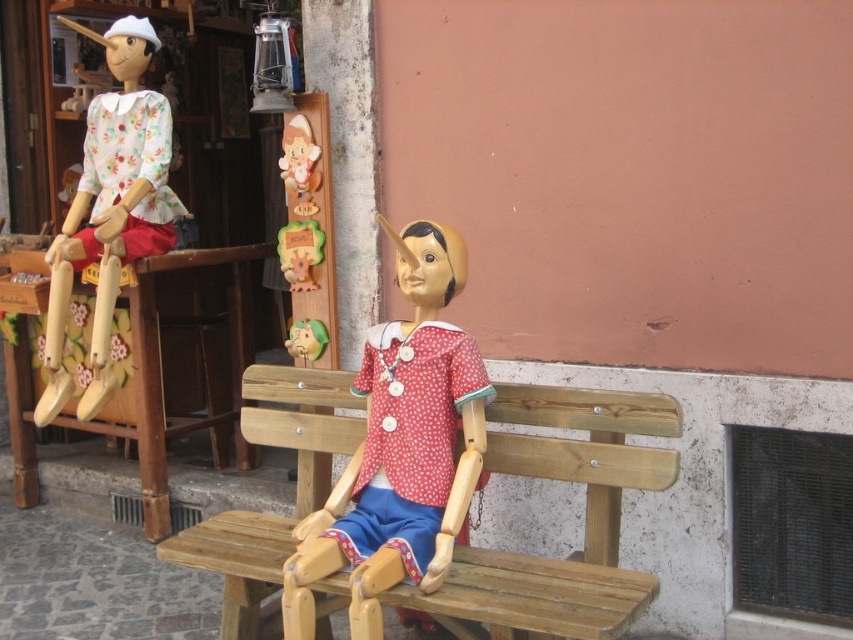
Who is positioned more to the left, floral fabric doll at left or wooden toy at center?

floral fabric doll at left

Is floral fabric doll at left to the left of wooden toy at center from the viewer's perspective?

Indeed, floral fabric doll at left is positioned on the left side of wooden toy at center.

The height and width of the screenshot is (640, 853). I want to click on floral fabric doll at left, so click(x=109, y=209).

You are a GUI agent. You are given a task and a screenshot of the screen. Output one action in this format:
    pyautogui.click(x=<x>, y=<y>)
    Task: Click on the floral fabric doll at left
    Image resolution: width=853 pixels, height=640 pixels.
    Given the screenshot: What is the action you would take?
    pyautogui.click(x=109, y=209)

Is wooden bench at center thinner than wooden toy at center?

In fact, wooden bench at center might be wider than wooden toy at center.

Between wooden bench at center and wooden toy at center, which one appears on the right side from the viewer's perspective?

Positioned to the right is wooden bench at center.

Is point (239, 538) closer to viewer compared to point (289, 266)?

Yes, point (239, 538) is in front of point (289, 266).

The height and width of the screenshot is (640, 853). What are the coordinates of `wooden bench at center` in the screenshot? It's located at (585, 515).

Who is higher up, wooden bench at center or wooden doll at center?

wooden doll at center is higher up.

Measure the distance between wooden bench at center and wooden doll at center.

wooden bench at center and wooden doll at center are 9.25 inches apart from each other.

Is point (589, 461) farther from camera compared to point (444, 458)?

No, (589, 461) is in front of (444, 458).

Where is `wooden bench at center`? This screenshot has width=853, height=640. wooden bench at center is located at coordinates (585, 515).